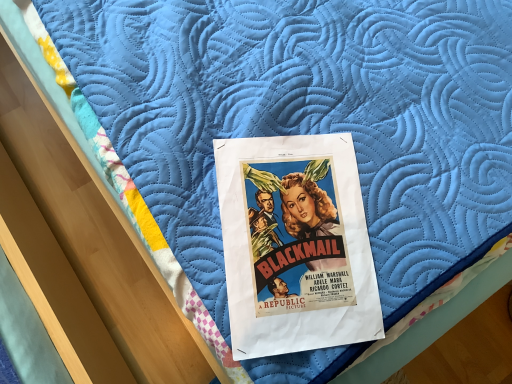
Locate an element on the screen. matte paper poster at center is located at coordinates (295, 245).

This screenshot has width=512, height=384. What do you see at coordinates (295, 245) in the screenshot?
I see `matte paper poster at center` at bounding box center [295, 245].

The height and width of the screenshot is (384, 512). Find the location of `matte paper poster at center`. matte paper poster at center is located at coordinates (295, 245).